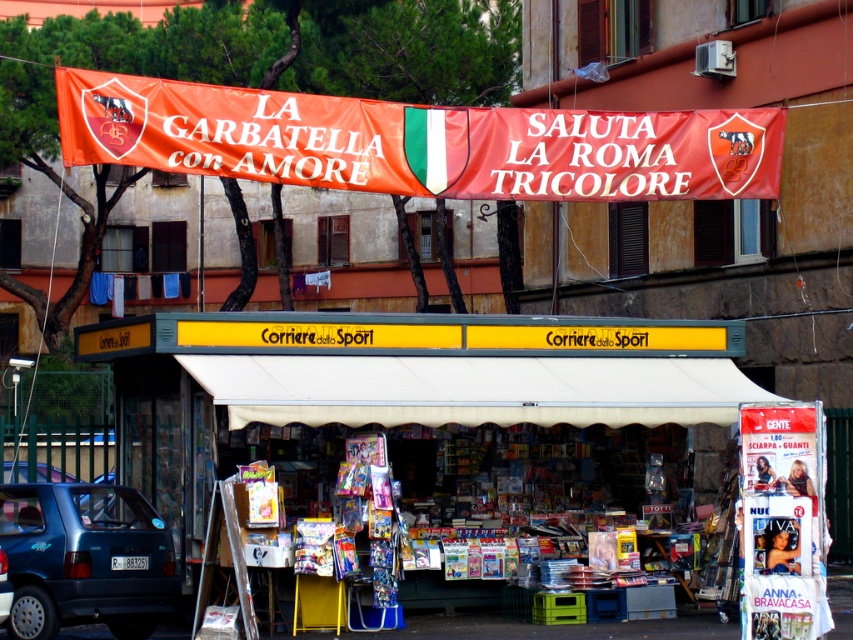
Which is more to the right, yellow corrugated metal kiosk at center or metallic blue car at lower left?

Positioned to the right is yellow corrugated metal kiosk at center.

Is yellow corrugated metal kiosk at center taller than metallic blue car at lower left?

No, yellow corrugated metal kiosk at center is not taller than metallic blue car at lower left.

Where is `yellow corrugated metal kiosk at center`? This screenshot has height=640, width=853. yellow corrugated metal kiosk at center is located at coordinates (390, 381).

Image resolution: width=853 pixels, height=640 pixels. What are the coordinates of `yellow corrugated metal kiosk at center` in the screenshot? It's located at (390, 381).

Does yellow corrugated metal kiosk at center appear under orange fabric banner at upper center?

Correct, yellow corrugated metal kiosk at center is located below orange fabric banner at upper center.

Is yellow corrugated metal kiosk at center to the left of orange fabric banner at upper center from the viewer's perspective?

In fact, yellow corrugated metal kiosk at center is to the right of orange fabric banner at upper center.

Between point (128, 465) and point (345, 141), which one is positioned behind?

Positioned behind is point (128, 465).

Find the location of a particular element. yellow corrugated metal kiosk at center is located at coordinates (390, 381).

Is point (132, 128) more distant than point (102, 566)?

Yes, it is.

Is point (560, 168) positioned after point (129, 620)?

Yes, it is behind point (129, 620).

Find the location of a particular element. This screenshot has width=853, height=640. orange fabric banner at upper center is located at coordinates (416, 141).